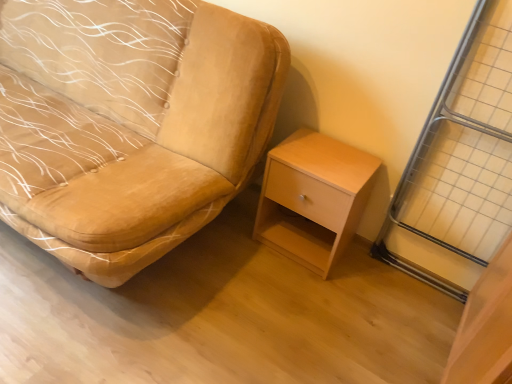
Question: Is velvet beige chair at center not close to metallic silver screen door at right?

Choices:
 (A) no
 (B) yes

Answer: (B)

Question: From a real-world perspective, is velvet beige chair at center under metallic silver screen door at right?

Choices:
 (A) yes
 (B) no

Answer: (A)

Question: Is velvet beige chair at center outside of metallic silver screen door at right?

Choices:
 (A) no
 (B) yes

Answer: (B)

Question: From the image's perspective, is velvet beige chair at center under metallic silver screen door at right?

Choices:
 (A) yes
 (B) no

Answer: (B)

Question: Would you say metallic silver screen door at right is part of velvet beige chair at center's contents?

Choices:
 (A) no
 (B) yes

Answer: (A)

Question: Does velvet beige chair at center have a smaller size compared to metallic silver screen door at right?

Choices:
 (A) yes
 (B) no

Answer: (B)

Question: Can you confirm if metallic silver screen door at right is wider than velvet beige chair at center?

Choices:
 (A) no
 (B) yes

Answer: (A)

Question: Is metallic silver screen door at right behind velvet beige chair at center?

Choices:
 (A) no
 (B) yes

Answer: (B)

Question: Considering the relative sizes of metallic silver screen door at right and velvet beige chair at center in the image provided, is metallic silver screen door at right shorter than velvet beige chair at center?

Choices:
 (A) yes
 (B) no

Answer: (B)

Question: Is metallic silver screen door at right placed right next to velvet beige chair at center?

Choices:
 (A) no
 (B) yes

Answer: (A)

Question: From the image's perspective, would you say metallic silver screen door at right is positioned over velvet beige chair at center?

Choices:
 (A) no
 (B) yes

Answer: (A)

Question: Considering the relative sizes of metallic silver screen door at right and velvet beige chair at center in the image provided, is metallic silver screen door at right thinner than velvet beige chair at center?

Choices:
 (A) no
 (B) yes

Answer: (B)

Question: Considering the relative sizes of metallic silver screen door at right and light wood/finely finished nightstand at lower right in the image provided, is metallic silver screen door at right thinner than light wood/finely finished nightstand at lower right?

Choices:
 (A) no
 (B) yes

Answer: (B)